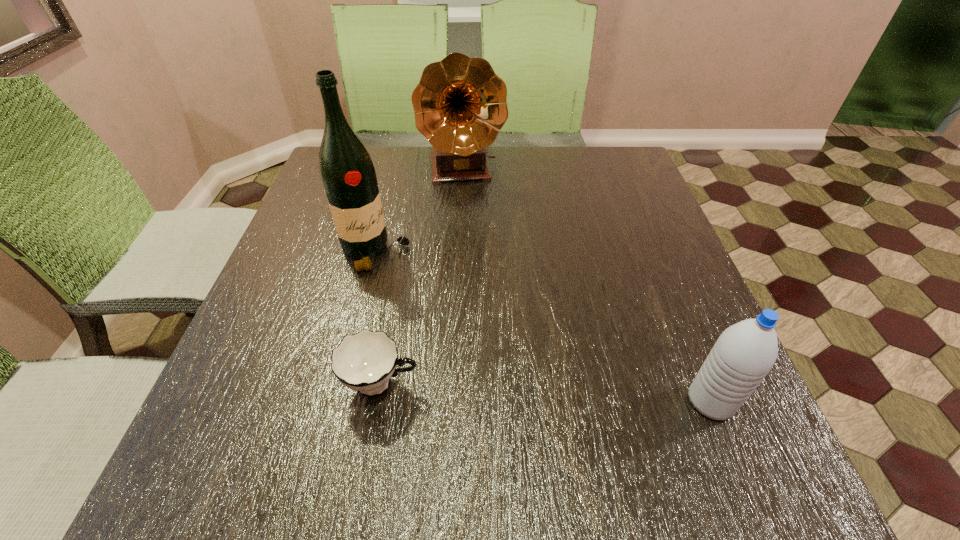
Locate an element on the screen. The width and height of the screenshot is (960, 540). vacant space located 0.090m on the horn of the phonograph_record is located at coordinates (471, 214).

This screenshot has width=960, height=540. I want to click on vacant space positioned 0.360m on the surface of the third nearest object, so click(513, 373).

Where is `blank space located 0.310m on the surface of the third nearest object`? blank space located 0.310m on the surface of the third nearest object is located at coordinates (492, 355).

Find the location of a particular element. vacant space located 0.220m on the surface of the third nearest object is located at coordinates (461, 327).

Where is `object at the far edge`? The height and width of the screenshot is (540, 960). object at the far edge is located at coordinates (460, 106).

Find the location of `cup present at the near edge`. cup present at the near edge is located at coordinates (365, 361).

Find the location of a particular element. Image resolution: width=960 pixels, height=540 pixels. water bottle that is at the near edge is located at coordinates (745, 352).

Where is `object that is at the left edge`? This screenshot has height=540, width=960. object that is at the left edge is located at coordinates (347, 172).

At what (x,y) coordinates should I click in order to perform the action: click on object that is at the right edge. Please return your answer as a coordinate pair (x, y). Looking at the image, I should click on pyautogui.click(x=745, y=352).

Locate an element on the screen. The width and height of the screenshot is (960, 540). object present at the near right corner is located at coordinates (745, 352).